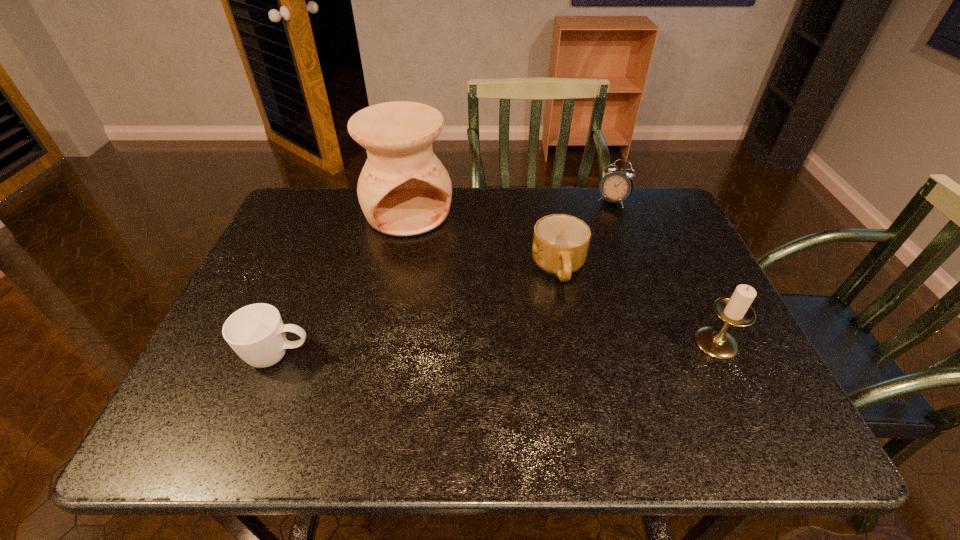
This screenshot has width=960, height=540. In order to click on pottery that is at the far edge in this screenshot , I will do `click(404, 190)`.

Where is `object that is positioned at the near edge`? This screenshot has height=540, width=960. object that is positioned at the near edge is located at coordinates (256, 333).

I want to click on object present at the left edge, so click(256, 333).

This screenshot has width=960, height=540. In order to click on candle holder that is at the right edge in this screenshot , I will do `click(735, 310)`.

The image size is (960, 540). In order to click on alarm clock that is at the right edge in this screenshot , I will do `click(616, 186)`.

Where is `object present at the near left corner`? This screenshot has width=960, height=540. object present at the near left corner is located at coordinates (256, 333).

Find the location of a particular element. Image resolution: width=960 pixels, height=540 pixels. object positioned at the far right corner is located at coordinates (616, 186).

Where is `free space at the far edge of the desktop`? Image resolution: width=960 pixels, height=540 pixels. free space at the far edge of the desktop is located at coordinates pyautogui.click(x=354, y=215).

In the image, there is a desktop. At what (x,y) coordinates should I click in order to perform the action: click on free space at the near edge. Please return your answer as a coordinate pair (x, y). Looking at the image, I should click on tap(449, 383).

You are a GUI agent. You are given a task and a screenshot of the screen. Output one action in this format:
    pyautogui.click(x=<x>, y=<y>)
    Task: Click on the vacant space at the left edge of the desktop
    
    Given the screenshot: What is the action you would take?
    pyautogui.click(x=252, y=301)